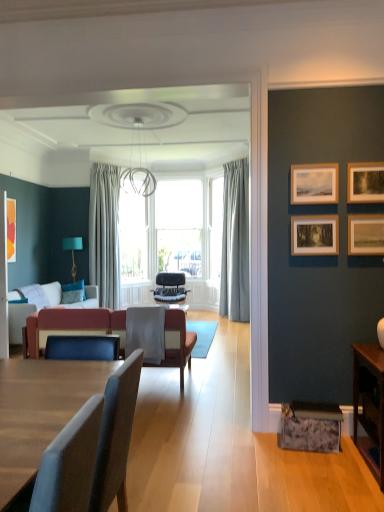
Question: Considering the positions of wooden picture frame at upper right, the 2th picture frame from the back, and black leather chair at center, the 2th chair from the front, in the image, is wooden picture frame at upper right, the 2th picture frame from the back, wider or thinner than black leather chair at center, the 2th chair from the front,?

Choices:
 (A) thin
 (B) wide

Answer: (A)

Question: In terms of height, does wooden picture frame at upper right, which is the third picture frame in right-to-left order, look taller or shorter compared to black leather chair at center, the 2th chair from the front?

Choices:
 (A) short
 (B) tall

Answer: (A)

Question: Estimate the real-world distances between objects in this image. Which object is closer to the wooden table at lower right?

Choices:
 (A) transparent glass window at center
 (B) wooden picture frame at upper right, which is the 3th picture frame from front to back
 (C) velvet red couch at center
 (D) fabric cushioned chair at center, arranged as the first chair when viewed from the front
 (E) orange matte picture frame at left, the first picture frame viewed from the left

Answer: (B)

Question: Based on their relative distances, which object is farther from the gray fabric curtain at center, placed as the first curtain when sorted from right to left?

Choices:
 (A) orange matte picture frame at left, marked as the 4th picture frame in a right-to-left arrangement
 (B) wooden picture frame at upper right, the second picture frame when ordered from left to right
 (C) fabric cushioned chair at center, arranged as the first chair when viewed from the front
 (D) velvet red couch at center
 (E) light gray sheer curtain at center, marked as the 1th curtain in a left-to-right arrangement

Answer: (C)